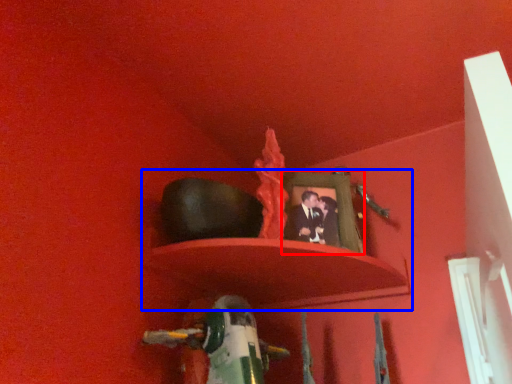
Question: Among these objects, which one is nearest to the camera, picture frame (highlighted by a red box) or shelf (highlighted by a blue box)?

Choices:
 (A) picture frame
 (B) shelf

Answer: (B)